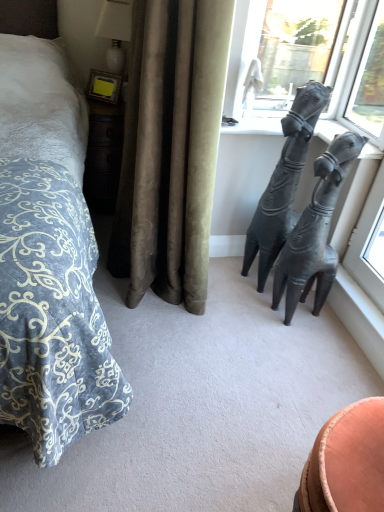
Question: From a real-world perspective, is black matte sculpture at right, which is the 2th statue (sculpture) from right to left, below transparent glass window at upper right, the 1th window from the right?

Choices:
 (A) yes
 (B) no

Answer: (A)

Question: Is black matte sculpture at right, which is counted as the first statue (sculpture), starting from the left, not close to transparent glass window at upper right, placed as the second window when sorted from left to right?

Choices:
 (A) no
 (B) yes

Answer: (A)

Question: Is black matte sculpture at right, which is counted as the first statue (sculpture), starting from the left, positioned with its back to transparent glass window at upper right, the 1th window from the right?

Choices:
 (A) yes
 (B) no

Answer: (A)

Question: Does black matte sculpture at right, which is counted as the first statue (sculpture), starting from the left, have a lesser width compared to transparent glass window at upper right, placed as the second window when sorted from left to right?

Choices:
 (A) yes
 (B) no

Answer: (B)

Question: Is black matte sculpture at right, which is counted as the first statue (sculpture), starting from the left, bigger than transparent glass window at upper right, placed as the second window when sorted from left to right?

Choices:
 (A) yes
 (B) no

Answer: (A)

Question: Does black matte sculpture at right, which is counted as the first statue (sculpture), starting from the left, have a greater width compared to transparent glass window at upper right, placed as the second window when sorted from left to right?

Choices:
 (A) yes
 (B) no

Answer: (A)

Question: Is black matte sculpture at right, which is counted as the first statue (sculpture), starting from the left, to the left of transparent glass window at upper right, which is counted as the 1th window, starting from the left, from the viewer's perspective?

Choices:
 (A) no
 (B) yes

Answer: (B)

Question: Is black matte sculpture at right, which is the 2th statue (sculpture) from right to left, outside transparent glass window at upper right, the second window from the right?

Choices:
 (A) yes
 (B) no

Answer: (A)

Question: Considering the relative positions of black matte sculpture at right, which is the 2th statue (sculpture) from right to left, and transparent glass window at upper right, the second window from the right, in the image provided, is black matte sculpture at right, which is the 2th statue (sculpture) from right to left, behind transparent glass window at upper right, the second window from the right,?

Choices:
 (A) no
 (B) yes

Answer: (A)

Question: Can transparent glass window at upper right, the second window from the right, be found inside black matte sculpture at right, which is counted as the first statue (sculpture), starting from the left?

Choices:
 (A) yes
 (B) no

Answer: (B)

Question: Is black matte sculpture at right, which is counted as the first statue (sculpture), starting from the left, wider than transparent glass window at upper right, which is counted as the 1th window, starting from the left?

Choices:
 (A) no
 (B) yes

Answer: (B)

Question: Can you confirm if black matte sculpture at right, which is counted as the first statue (sculpture), starting from the left, is taller than transparent glass window at upper right, which is counted as the 1th window, starting from the left?

Choices:
 (A) no
 (B) yes

Answer: (B)

Question: From a real-world perspective, is transparent glass window at upper right, placed as the second window when sorted from left to right, positioned under white glossy lamp at upper left based on gravity?

Choices:
 (A) yes
 (B) no

Answer: (B)